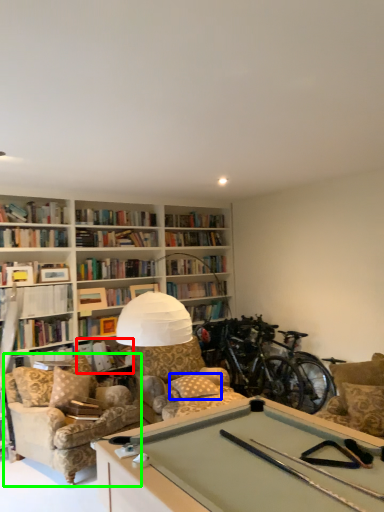
Question: Which is farther away from book (highlighted by a red box)? pillow (highlighted by a blue box) or chair (highlighted by a green box)?

Choices:
 (A) pillow
 (B) chair

Answer: (A)